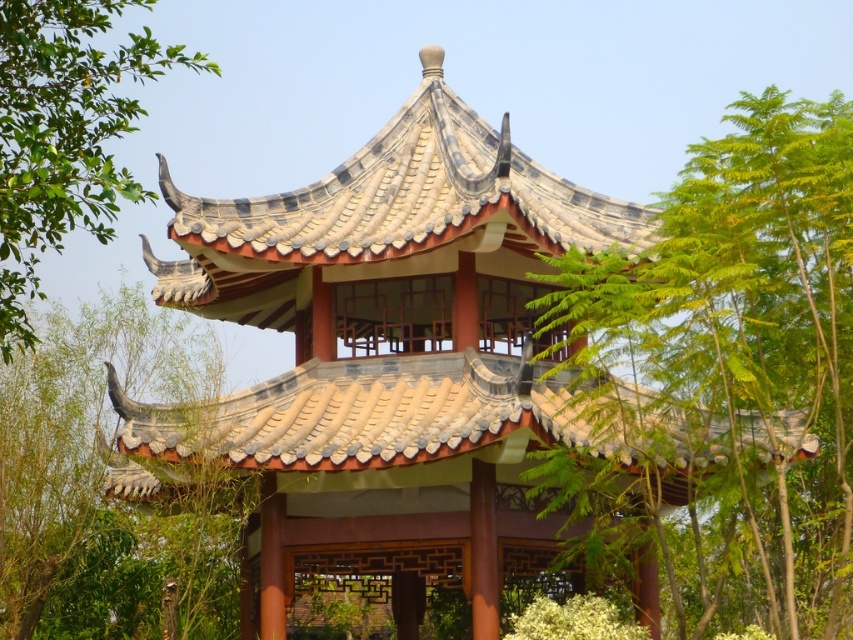
Question: Does green leafy tree at center have a larger size compared to green leafy tree at upper left?

Choices:
 (A) no
 (B) yes

Answer: (A)

Question: Which of the following is the closest to the observer?

Choices:
 (A) (80, 108)
 (B) (166, 326)

Answer: (A)

Question: Estimate the real-world distances between objects in this image. Which object is farther from the green leafy tree at center?

Choices:
 (A) green leafy tree at upper left
 (B) brown textured roof at upper center

Answer: (A)

Question: Which object is positioned farthest from the green leafy tree at center?

Choices:
 (A) brown textured roof at upper center
 (B) green leafy tree at upper left

Answer: (B)

Question: Is the position of green leafy tree at center less distant than that of brown textured roof at upper center?

Choices:
 (A) yes
 (B) no

Answer: (A)

Question: Can you confirm if brown textured roof at upper center is positioned to the left of green leafy tree at upper left?

Choices:
 (A) yes
 (B) no

Answer: (B)